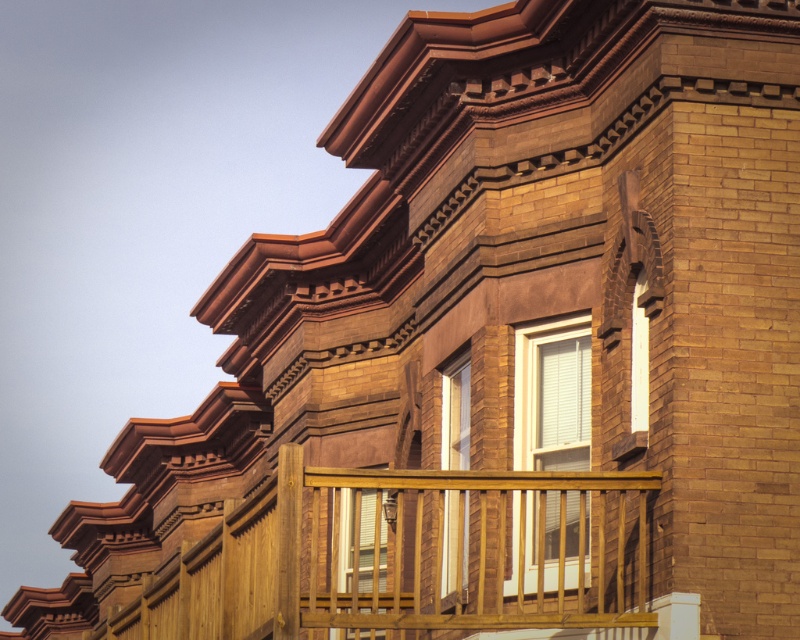
You are standing on the street looking up at the building. You see the wooden at upper center and the white matte window at upper right. Which object is closer to the ground?

The wooden at upper center is closer to the ground because it is located below the white matte window at upper right.

You are standing in front of a multi story brick building and looking at the two windows, the matte white window at center and the matte glass window at center. Which window is nearer to you?

The matte white window at center is closer to the viewer than the matte glass window at center, so the matte white window at center is nearer to you.

You are an architect analyzing the building facade. You need to determine which object, the wooden at upper center or the white matte window at upper right, occupies more vertical space on the facade. Based on the scene, which one is taller?

The wooden at upper center is taller than the white matte window at upper right according to the description.